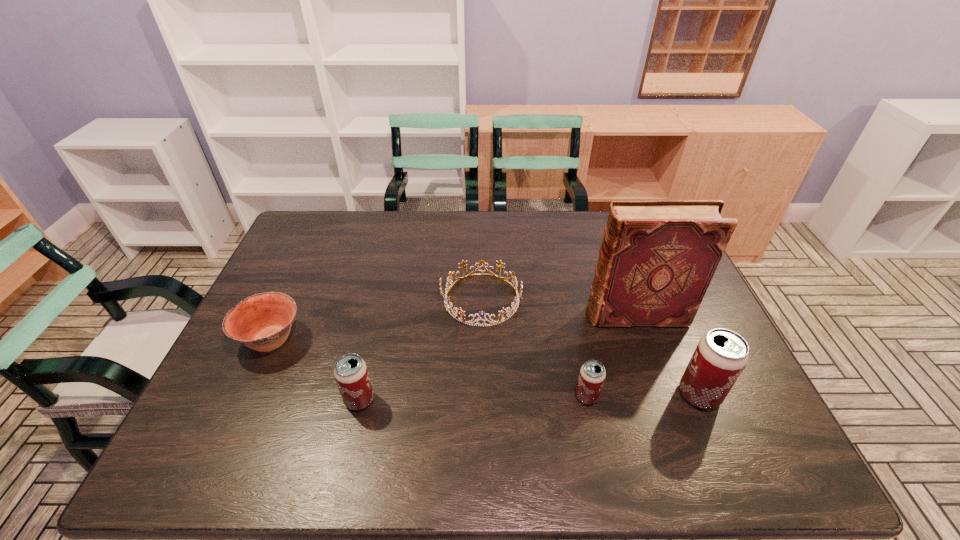
This screenshot has width=960, height=540. In order to click on location for an additional beer_can to make spacing equal in this screenshot , I will do `click(473, 398)`.